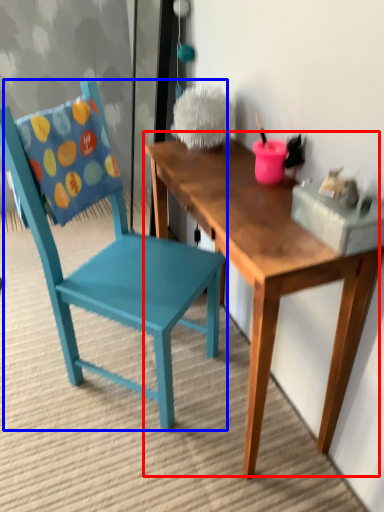
Question: Which object is further to the camera taking this photo, table (highlighted by a red box) or chair (highlighted by a blue box)?

Choices:
 (A) table
 (B) chair

Answer: (B)